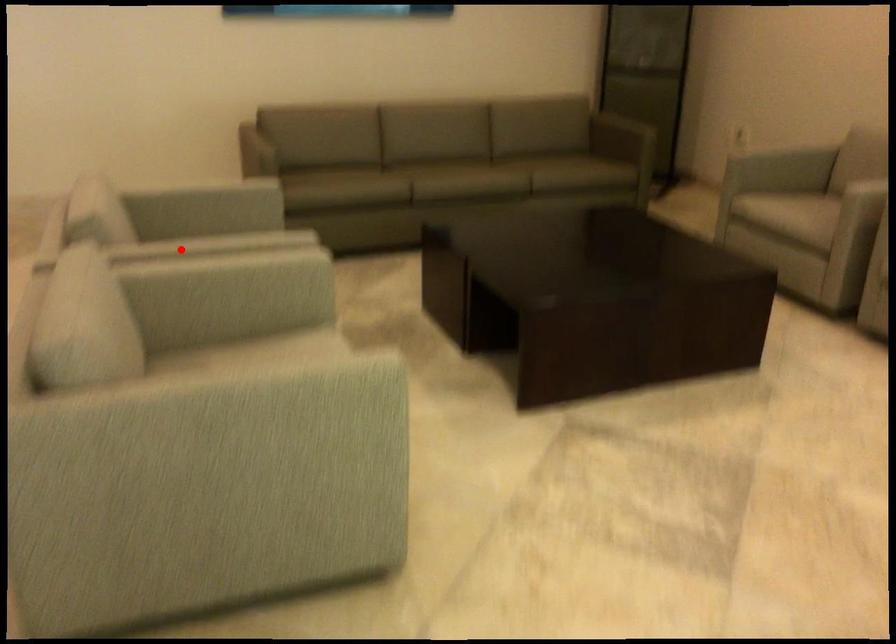
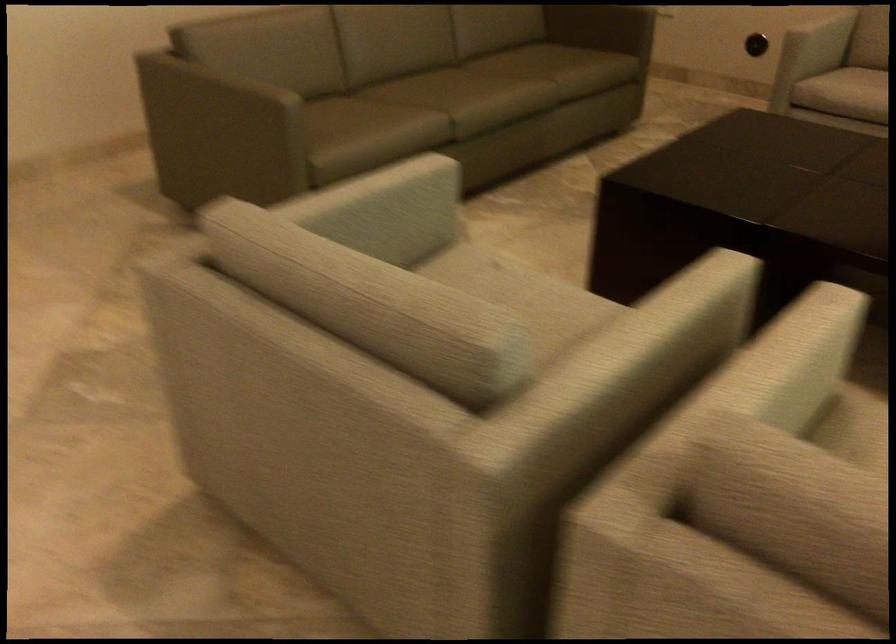
The point at the highlighted location is marked in the first image. Where is the corresponding point in the second image?

(659, 332)